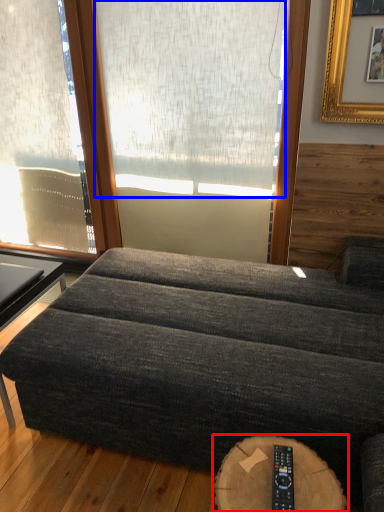
Question: Which of the following is the closest to the observer, round table (highlighted by a red box) or window screen (highlighted by a blue box)?

Choices:
 (A) round table
 (B) window screen

Answer: (A)